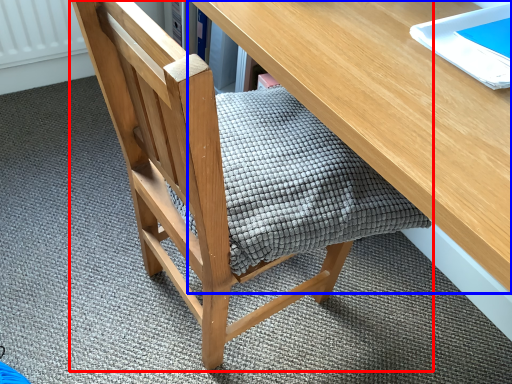
Question: Which point is further to the camera, chair (highlighted by a red box) or desk (highlighted by a blue box)?

Choices:
 (A) chair
 (B) desk

Answer: (A)